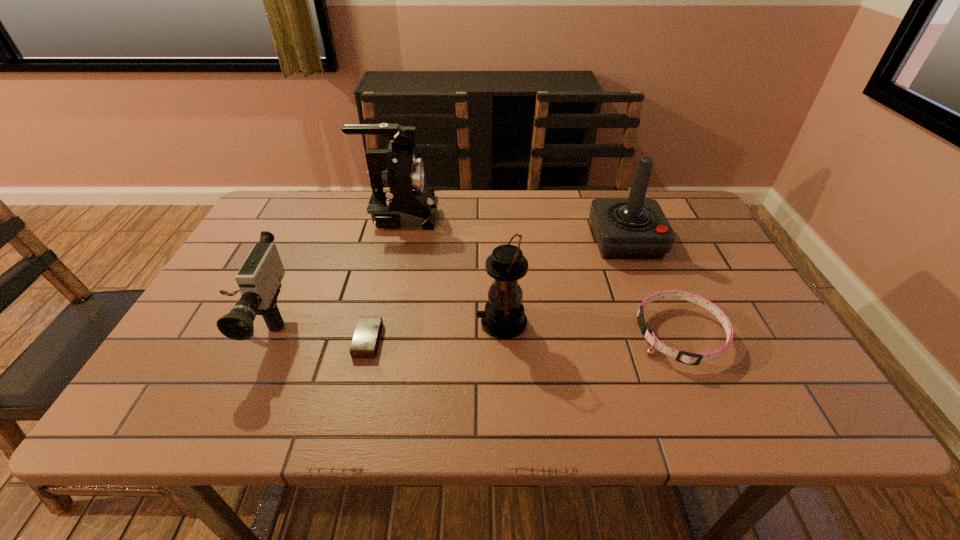
Can you find a vacant point located 0.340m above the fourth object from left to right, indicating its light source? Please provide its 2D coordinates. Your answer should be formatted as a tuple, i.e. [(x, y)], where the tuple contains the x and y coordinates of a point satisfying the conditions above.

[(329, 322)]

Identify a few spots in the free region located 0.180m above the fourth object from left to right, indicating its light source. Please provide its 2D coordinates. Your answer should be formatted as a tuple, i.e. [(x, y)], where the tuple contains the x and y coordinates of a point satisfying the conditions above.

[(399, 322)]

Select a few points in the free space located 0.240m above the fourth object from left to right, indicating its light source. Please provide its 2D coordinates. Your answer should be formatted as a tuple, i.e. [(x, y)], where the tuple contains the x and y coordinates of a point satisfying the conditions above.

[(373, 322)]

This screenshot has height=540, width=960. What are the coordinates of `vacant space located on the recording direction of the shorter camcorder` in the screenshot? It's located at (204, 421).

Image resolution: width=960 pixels, height=540 pixels. Identify the location of vacant area situated with the buckle on the dog collar. (535, 335).

Find the location of `vacant space positioned 0.060m with the buckle on the dog collar`. vacant space positioned 0.060m with the buckle on the dog collar is located at coordinates (611, 335).

The height and width of the screenshot is (540, 960). Identify the location of vacant space positioned with the buckle on the dog collar. (486, 335).

Where is `vacant area situated 0.350m on the front face of the alarm clock`? vacant area situated 0.350m on the front face of the alarm clock is located at coordinates (538, 341).

Identify the location of camcorder situated at the far edge. (401, 197).

The height and width of the screenshot is (540, 960). I want to click on joystick that is at the far edge, so click(x=635, y=228).